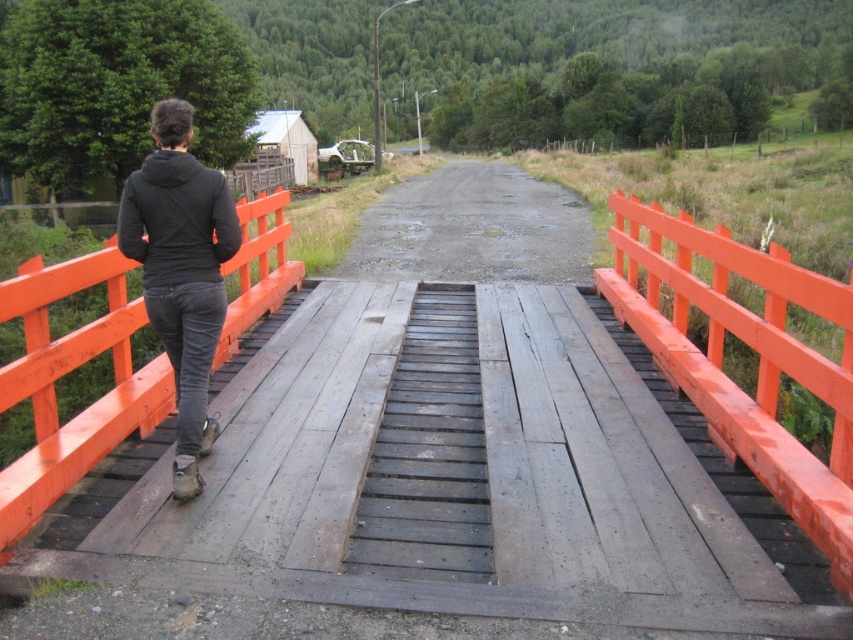
Question: Which object is closer to the camera taking this photo?

Choices:
 (A) dull gray asphalt road at center
 (B) black matte jacket at center
 (C) black matte jacket at upper left
 (D) orange painted wood at center

Answer: (D)

Question: Is black matte jacket at center to the right of dull gray asphalt road at center from the viewer's perspective?

Choices:
 (A) yes
 (B) no

Answer: (B)

Question: Is orange painted wood at center positioned behind black matte jacket at upper left?

Choices:
 (A) yes
 (B) no

Answer: (B)

Question: Is orange painted wood at center closer to the viewer compared to black matte jacket at upper left?

Choices:
 (A) no
 (B) yes

Answer: (B)

Question: Which point appears closest to the camera in this image?

Choices:
 (A) (479, 180)
 (B) (701, 300)
 (C) (231, 240)
 (D) (287, 230)

Answer: (C)

Question: Which point appears farthest from the camera in this image?

Choices:
 (A) (154, 179)
 (B) (498, 237)
 (C) (621, 204)
 (D) (152, 115)

Answer: (B)